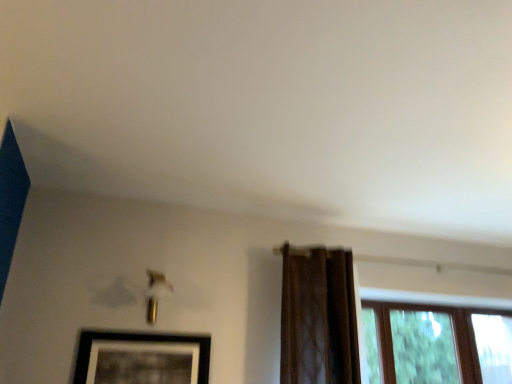
Question: Considering the relative positions of black matte picture frame at lower left and brown sheer curtain at right in the image provided, is black matte picture frame at lower left to the right of brown sheer curtain at right from the viewer's perspective?

Choices:
 (A) no
 (B) yes

Answer: (A)

Question: Is black matte picture frame at lower left positioned beyond the bounds of brown sheer curtain at right?

Choices:
 (A) no
 (B) yes

Answer: (B)

Question: Is black matte picture frame at lower left thinner than brown sheer curtain at right?

Choices:
 (A) yes
 (B) no

Answer: (A)

Question: Is black matte picture frame at lower left bigger than brown sheer curtain at right?

Choices:
 (A) no
 (B) yes

Answer: (A)

Question: Does black matte picture frame at lower left have a greater width compared to brown sheer curtain at right?

Choices:
 (A) yes
 (B) no

Answer: (B)

Question: Can you confirm if black matte picture frame at lower left is smaller than brown sheer curtain at right?

Choices:
 (A) yes
 (B) no

Answer: (A)

Question: From the image's perspective, is brown sheer curtain at right located above black matte picture frame at lower left?

Choices:
 (A) yes
 (B) no

Answer: (A)

Question: Is brown sheer curtain at right placed right next to black matte picture frame at lower left?

Choices:
 (A) no
 (B) yes

Answer: (A)

Question: Is black matte picture frame at lower left surrounded by brown sheer curtain at right?

Choices:
 (A) no
 (B) yes

Answer: (A)

Question: Is brown sheer curtain at right far away from black matte picture frame at lower left?

Choices:
 (A) no
 (B) yes

Answer: (A)

Question: From a real-world perspective, is brown sheer curtain at right physically below black matte picture frame at lower left?

Choices:
 (A) yes
 (B) no

Answer: (B)

Question: Can you confirm if brown sheer curtain at right is taller than black matte picture frame at lower left?

Choices:
 (A) yes
 (B) no

Answer: (A)

Question: Would you say brown sheer curtain at right is to the left or to the right of black matte picture frame at lower left in the picture?

Choices:
 (A) right
 (B) left

Answer: (A)